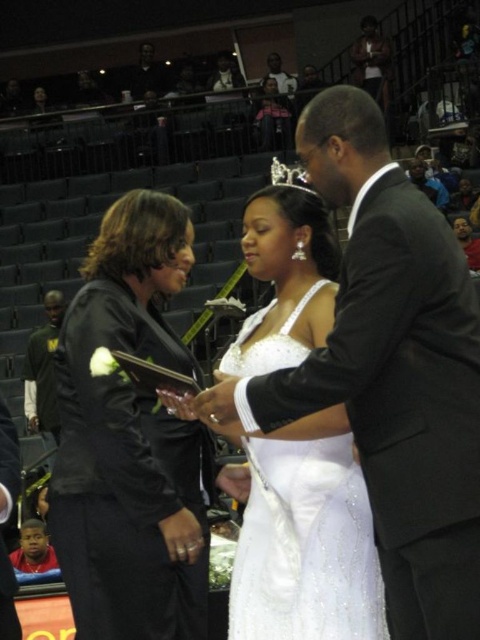
Is point (334, 568) less distant than point (48, 356)?

Yes, it is in front of point (48, 356).

Is white satin dress at center wider than dark green jersey at left?

No, white satin dress at center is not wider than dark green jersey at left.

Where is `white satin dress at center`? white satin dress at center is located at coordinates (305, 540).

How distant is black satin jacket at left from dark green jersey at left?

black satin jacket at left is 40.24 feet from dark green jersey at left.

Does black satin jacket at left appear under dark green jersey at left?

Correct, black satin jacket at left is located below dark green jersey at left.

The height and width of the screenshot is (640, 480). Describe the element at coordinates (130, 440) in the screenshot. I see `black satin jacket at left` at that location.

Locate an element on the screen. Image resolution: width=480 pixels, height=640 pixels. black satin jacket at left is located at coordinates (130, 440).

Can you confirm if dark green jersey at left is bigger than silver metallic tiara at center?

Incorrect, dark green jersey at left is not larger than silver metallic tiara at center.

Which is in front, point (60, 310) or point (283, 170)?

Point (283, 170) is more forward.

The image size is (480, 640). What are the coordinates of `dark green jersey at left` in the screenshot? It's located at (44, 372).

Image resolution: width=480 pixels, height=640 pixels. I want to click on dark green jersey at left, so click(x=44, y=372).